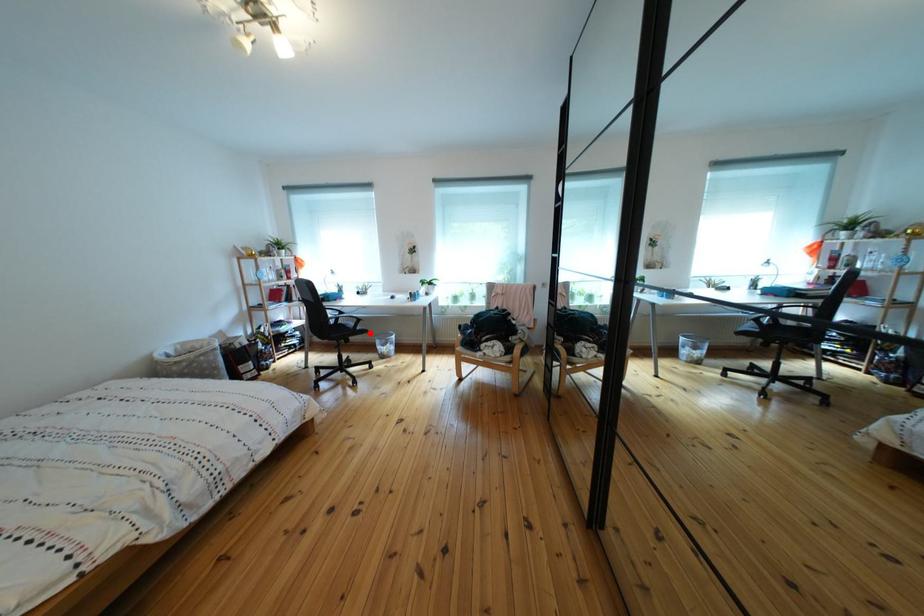
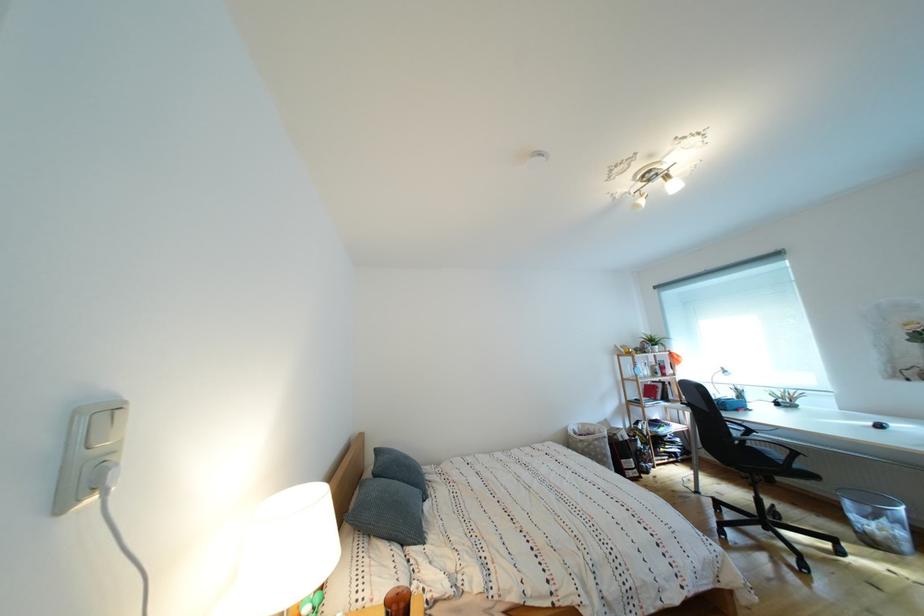
The point at the highlighted location is marked in the first image. Where is the corresponding point in the second image?

(808, 472)